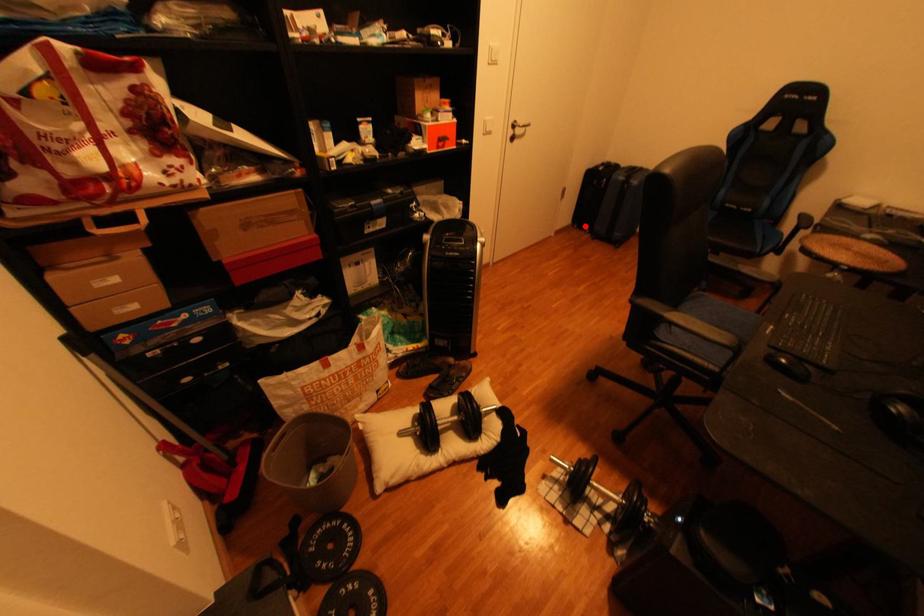
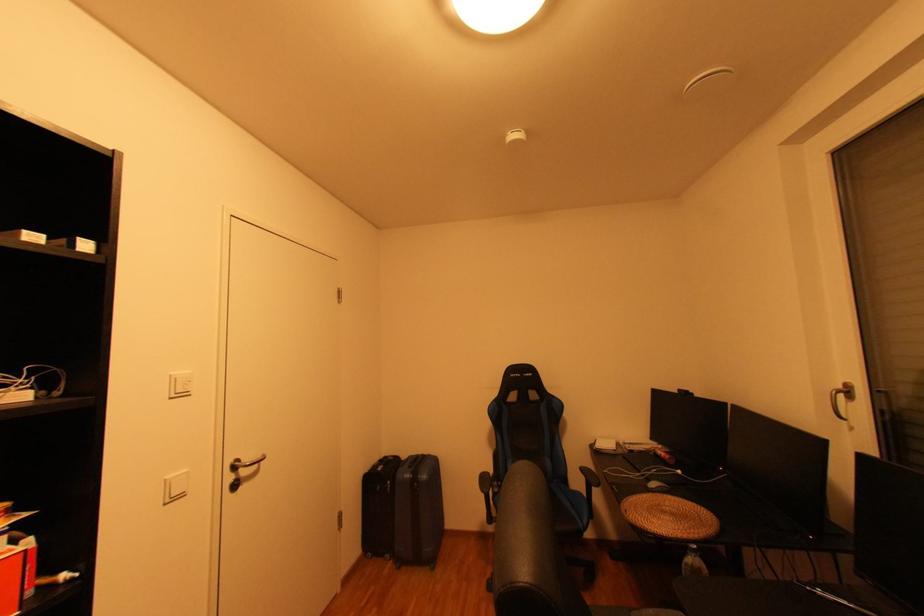
Question: I am providing you with two images of the same scene from different viewpoints. Given a red point in image1, look at the same physical point in image2. Is it:

Choices:
 (A) Closer to the viewpoint
 (B) Farther from the viewpoint

Answer: (B)